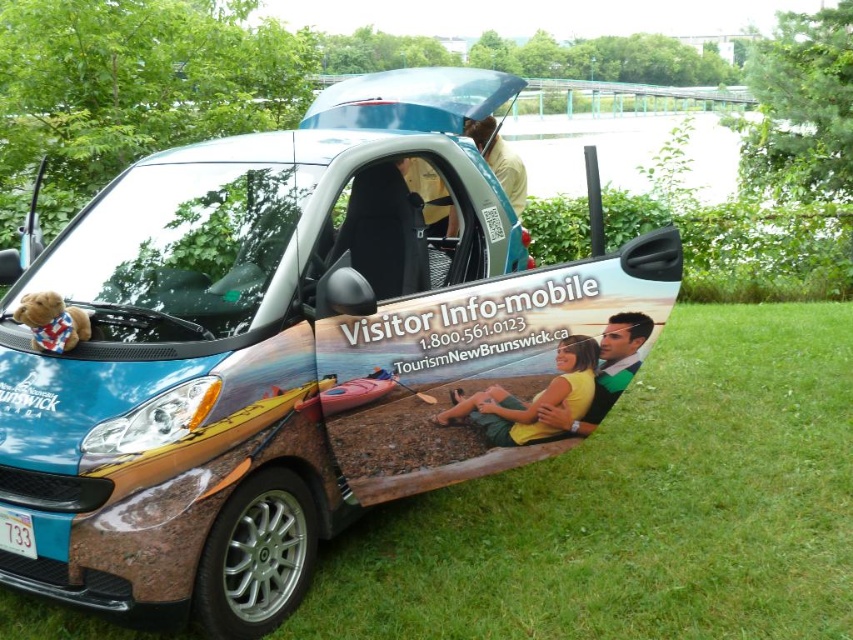
The width and height of the screenshot is (853, 640). Describe the element at coordinates (289, 349) in the screenshot. I see `metallic blue car at center` at that location.

Can you confirm if metallic blue car at center is thinner than light brown leather jacket at upper center?

Incorrect, metallic blue car at center's width is not less than light brown leather jacket at upper center's.

Between point (529, 308) and point (489, 128), which one is positioned behind?

Point (489, 128)

Where is `metallic blue car at center`? This screenshot has width=853, height=640. metallic blue car at center is located at coordinates (289, 349).

In the scene shown: Is yellow matte shirt at lower center to the right of light brown leather jacket at upper center from the viewer's perspective?

Yes, yellow matte shirt at lower center is to the right of light brown leather jacket at upper center.

In the scene shown: Can you confirm if yellow matte shirt at lower center is smaller than light brown leather jacket at upper center?

Yes, yellow matte shirt at lower center is smaller than light brown leather jacket at upper center.

Does point (459, 397) come closer to viewer compared to point (509, 192)?

Yes, it is.

Where is `yellow matte shirt at lower center`? yellow matte shirt at lower center is located at coordinates (531, 400).

Is metallic blue car at center shorter than yellow matte shirt at lower center?

In fact, metallic blue car at center may be taller than yellow matte shirt at lower center.

Between metallic blue car at center and yellow matte shirt at lower center, which one appears on the left side from the viewer's perspective?

From the viewer's perspective, metallic blue car at center appears more on the left side.

Does point (444, 193) come behind point (518, 432)?

Yes.

You are a GUI agent. You are given a task and a screenshot of the screen. Output one action in this format:
    pyautogui.click(x=<x>, y=<y>)
    Task: Click on the metallic blue car at center
    
    Given the screenshot: What is the action you would take?
    pyautogui.click(x=289, y=349)